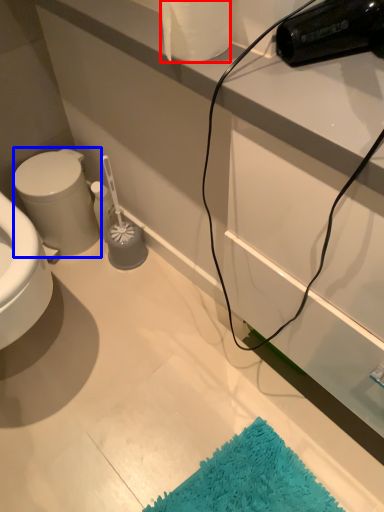
Question: Which point is closer to the camera, toilet paper (highlighted by a red box) or bidet (highlighted by a blue box)?

Choices:
 (A) toilet paper
 (B) bidet

Answer: (A)